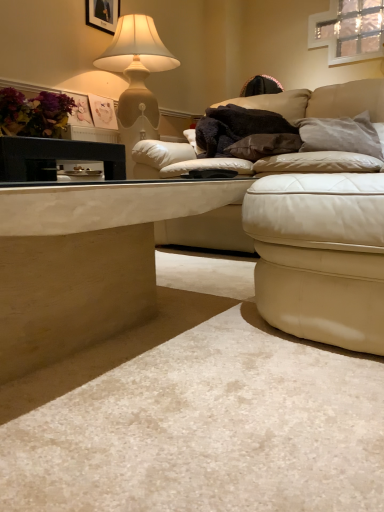
Question: Is leather ottoman at lower right oriented towards brown suede pillow at center, the 1th pillow viewed from the left?

Choices:
 (A) yes
 (B) no

Answer: (B)

Question: Is there a large distance between leather ottoman at lower right and brown suede pillow at center, which is counted as the second pillow, starting from the right?

Choices:
 (A) yes
 (B) no

Answer: (A)

Question: Considering the relative sizes of leather ottoman at lower right and brown suede pillow at center, the 1th pillow viewed from the left, in the image provided, is leather ottoman at lower right thinner than brown suede pillow at center, the 1th pillow viewed from the left,?

Choices:
 (A) yes
 (B) no

Answer: (B)

Question: Is leather ottoman at lower right smaller than brown suede pillow at center, which is counted as the second pillow, starting from the right?

Choices:
 (A) yes
 (B) no

Answer: (B)

Question: Does leather ottoman at lower right contain brown suede pillow at center, which is counted as the second pillow, starting from the right?

Choices:
 (A) no
 (B) yes

Answer: (A)

Question: Is leather ottoman at lower right to the left of brown suede pillow at center, the 1th pillow viewed from the left, from the viewer's perspective?

Choices:
 (A) yes
 (B) no

Answer: (A)

Question: Is leather ottoman at lower right wider than gray suede pillow at upper right, placed as the 2th pillow when sorted from left to right?

Choices:
 (A) yes
 (B) no

Answer: (A)

Question: Is leather ottoman at lower right positioned in front of gray suede pillow at upper right, which is the first pillow from right to left?

Choices:
 (A) yes
 (B) no

Answer: (A)

Question: Is the position of leather ottoman at lower right more distant than that of gray suede pillow at upper right, which is the first pillow from right to left?

Choices:
 (A) yes
 (B) no

Answer: (B)

Question: Does leather ottoman at lower right appear on the right side of gray suede pillow at upper right, placed as the 2th pillow when sorted from left to right?

Choices:
 (A) yes
 (B) no

Answer: (B)

Question: Is leather ottoman at lower right completely or partially outside of gray suede pillow at upper right, which is the first pillow from right to left?

Choices:
 (A) no
 (B) yes

Answer: (B)

Question: From a real-world perspective, is leather ottoman at lower right on gray suede pillow at upper right, which is the first pillow from right to left?

Choices:
 (A) no
 (B) yes

Answer: (A)

Question: Are matte beige lamp at upper left and smooth beige table at lower left, the 2th table positioned from the top, far apart?

Choices:
 (A) yes
 (B) no

Answer: (A)